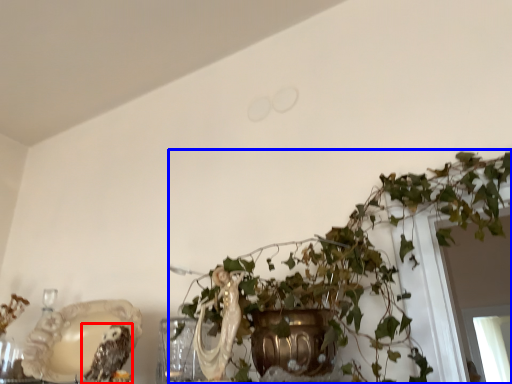
Question: Which of the following is the farthest to the observer, owl (highlighted by a red box) or houseplant (highlighted by a blue box)?

Choices:
 (A) owl
 (B) houseplant

Answer: (A)